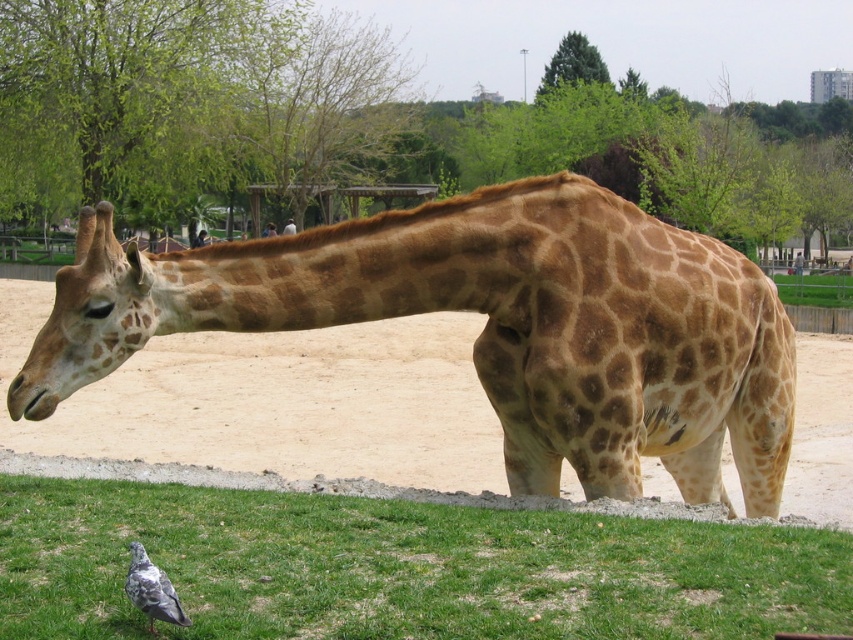
You are standing in front of the giraffe and want to determine which of the two points, point (x=97, y=586) or point (x=202, y=307), is closer to you. Based on the image, which point is nearer?

Point (x=97, y=586) is closer to the viewer than point (x=202, y=307).

You are a photographer trying to capture a photo of both the brown spotted giraffe at center and the gray feathered pigeon at lower left in the same frame. Based on their positions, which animal should you focus on first to ensure both are in the frame?

The brown spotted giraffe at center is positioned on the right side of gray feathered pigeon at lower left. To include both in the frame, focus on the gray feathered pigeon at lower left first as it is closer to the edge, then adjust to include the giraffe on its right.

You are a photographer trying to capture a clear photo of the gray feathered pigeon at lower left. However, the brown spotted giraffe at center is blocking your view. Can you move to the side to get an unobstructed shot of the pigeon?

The gray feathered pigeon at lower left is behind the brown spotted giraffe at center, so moving to the side might allow you to see around the giraffe and capture the pigeon without obstruction.